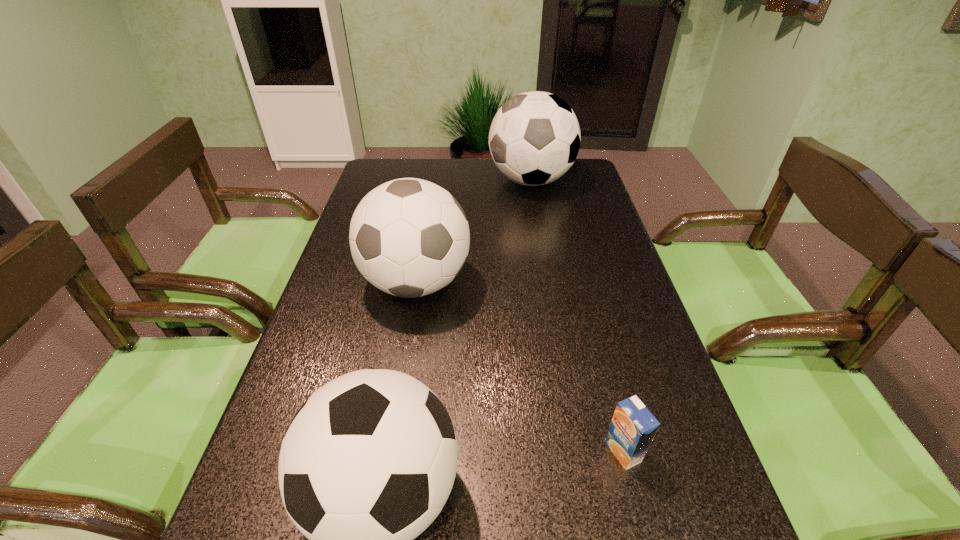
Identify the location of the farthest soccer ball. This screenshot has width=960, height=540. (534, 138).

Where is `the farthest object`? Image resolution: width=960 pixels, height=540 pixels. the farthest object is located at coordinates (534, 138).

At what (x,y) coordinates should I click in order to perform the action: click on the second nearest soccer ball. Please return your answer as a coordinate pair (x, y). Looking at the image, I should click on (409, 237).

The width and height of the screenshot is (960, 540). Find the location of `orange_juice`. orange_juice is located at coordinates (632, 429).

Where is `vacant space located on the main logo of the rightmost soccer ball`? vacant space located on the main logo of the rightmost soccer ball is located at coordinates (442, 180).

Where is `vacant space located on the main logo of the rightmost soccer ball`? Image resolution: width=960 pixels, height=540 pixels. vacant space located on the main logo of the rightmost soccer ball is located at coordinates (404, 180).

Where is `vacant space located 0.200m on the main logo of the rightmost soccer ball`? vacant space located 0.200m on the main logo of the rightmost soccer ball is located at coordinates (430, 180).

Where is `vacant space situated on the back of the second farthest soccer ball`? vacant space situated on the back of the second farthest soccer ball is located at coordinates (430, 198).

Locate an element on the screen. Image resolution: width=960 pixels, height=540 pixels. blank space located 0.210m on the back of the orange_juice is located at coordinates click(x=596, y=345).

The width and height of the screenshot is (960, 540). I want to click on object present at the far edge, so click(534, 138).